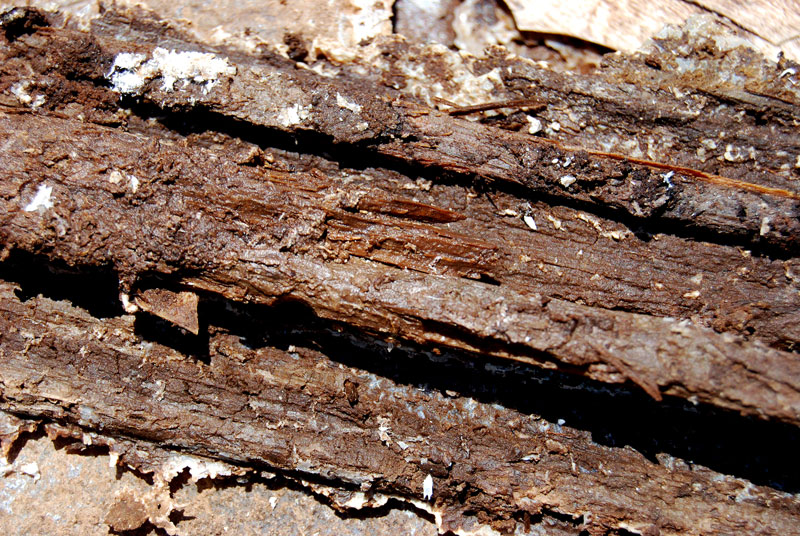
Locate an element on the screen. Image resolution: width=800 pixels, height=536 pixels. broken floor tile is located at coordinates (624, 25).